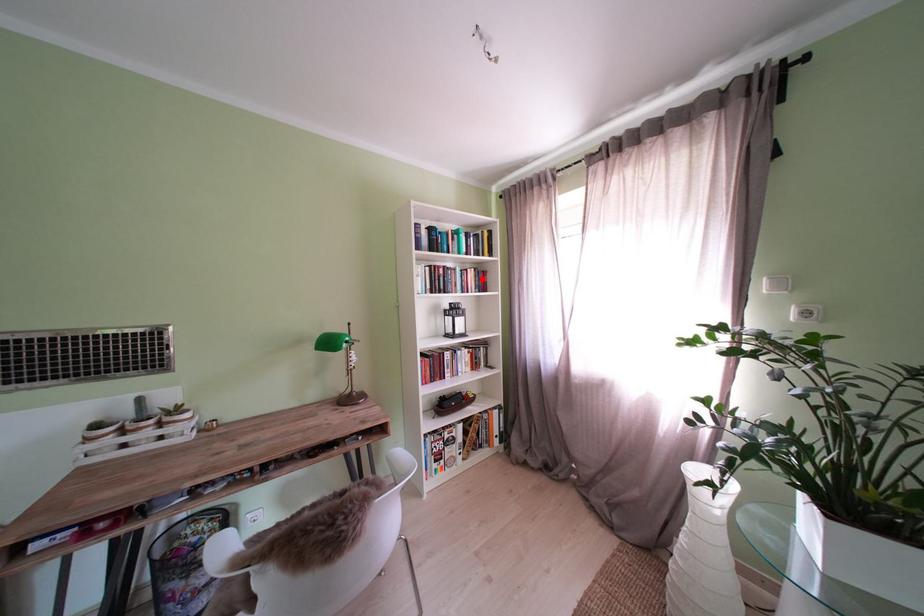
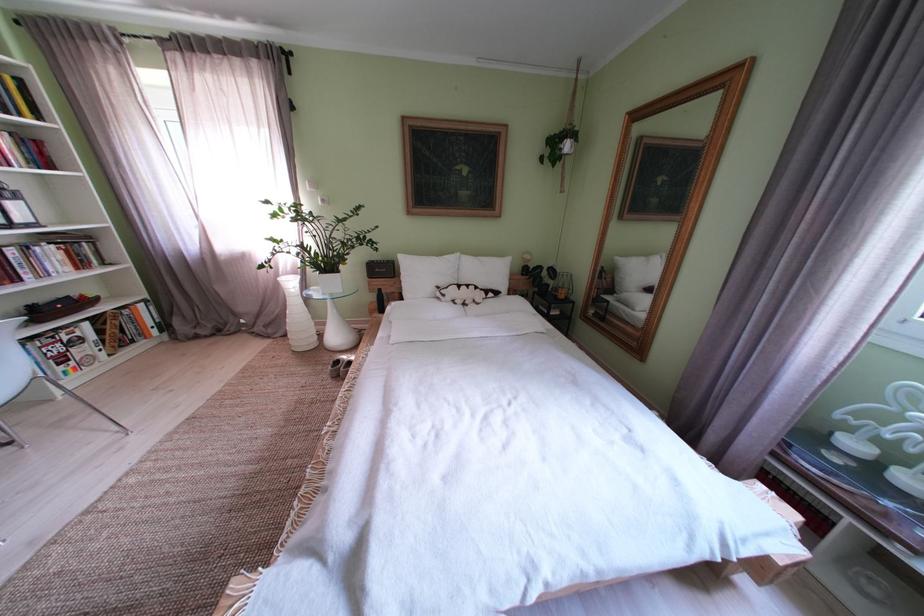
Question: I am providing you with two images of the same scene from different viewpoints. A red point is shown in image1. For the corresponding object point in image2, is it positioned nearer or farther from the camera?

Choices:
 (A) Nearer
 (B) Farther

Answer: (B)